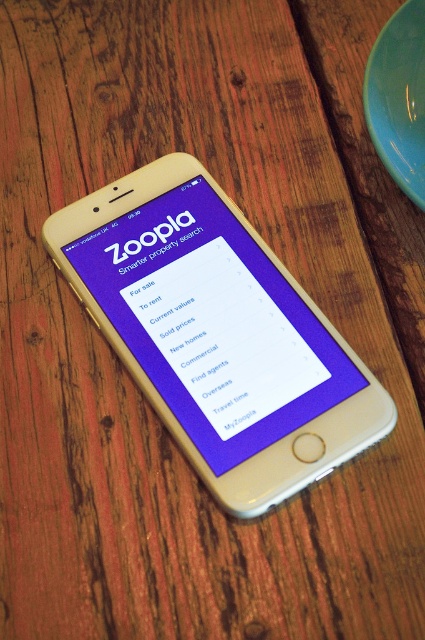
You are a real estate agent who needs to check property listings on the purple matte screen at center. However, there is a matte green plate at upper right blocking your view. Can you move the plate to access the screen?

The purple matte screen at center is located below the matte green plate at upper right, so you can move the matte green plate at upper right to access the purple matte screen at center.